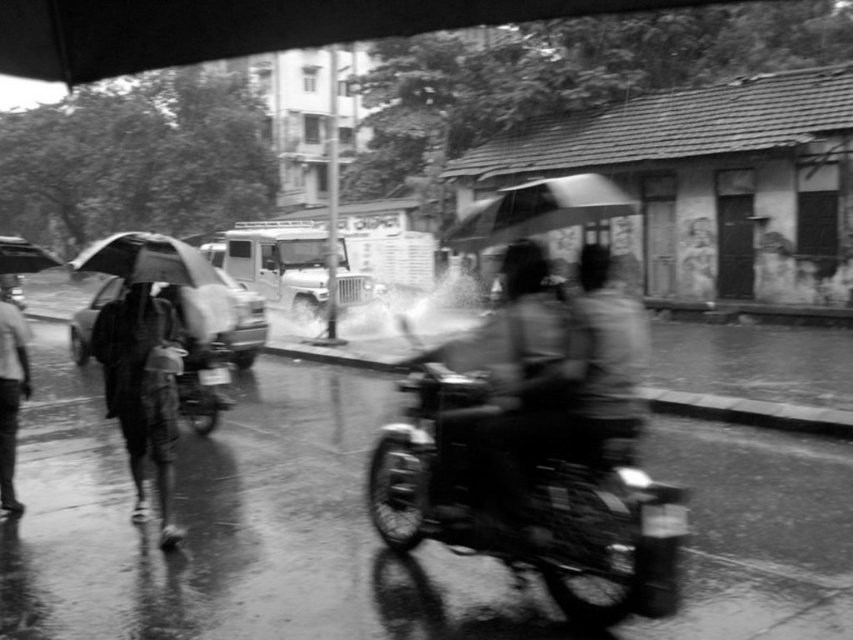
Based on the scene description, where is the smooth black motorcycle at center located in terms of coordinates?

The smooth black motorcycle at center is located at coordinates point (502, 396).

You are a delivery rider on a smooth black motorcycle at center. You need to pass through a narrow alley that is as wide as the motorcycle. There is a transparent plastic umbrella at center in your path. Can you pass through the alley without touching the umbrella?

The smooth black motorcycle at center has a lesser width compared to transparent plastic umbrella at center. Since the alley is as wide as the motorcycle, there will be no space left for the umbrella. Therefore, you cannot pass through the alley without touching the umbrella.